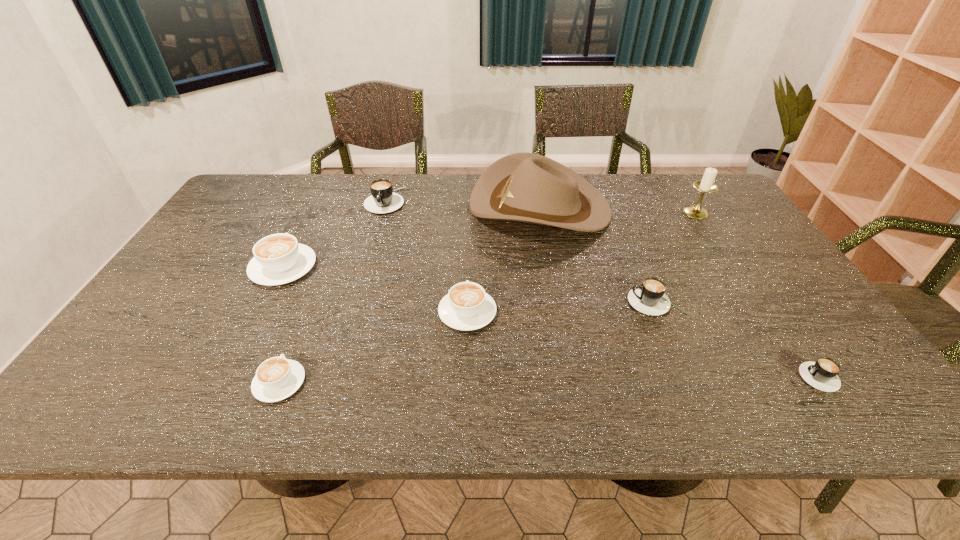
Locate an element on the screen. This screenshot has height=540, width=960. cowboy hat is located at coordinates (525, 187).

Where is `white candle holder`? This screenshot has width=960, height=540. white candle holder is located at coordinates (706, 185).

Find the location of a particular element. Image resolution: width=960 pixels, height=540 pixels. the farthest white cappuccino is located at coordinates (278, 259).

Identify the location of the farthest cappuccino. (383, 200).

Find the location of `the biggest black cappuccino`. the biggest black cappuccino is located at coordinates (383, 200).

Locate an element on the screen. The image size is (960, 540). the third cappuccino from right to left is located at coordinates [466, 307].

At what (x,y) coordinates should I click in order to perform the action: click on the rightmost white cappuccino. Please return your answer as a coordinate pair (x, y). The width and height of the screenshot is (960, 540). Looking at the image, I should click on (466, 307).

The width and height of the screenshot is (960, 540). In order to click on the second black cappuccino from left to right in this screenshot , I will do `click(649, 298)`.

The width and height of the screenshot is (960, 540). Find the location of `the fifth cappuccino from left to right`. the fifth cappuccino from left to right is located at coordinates (649, 298).

What are the coordinates of `the nearest white cappuccino` in the screenshot? It's located at (277, 378).